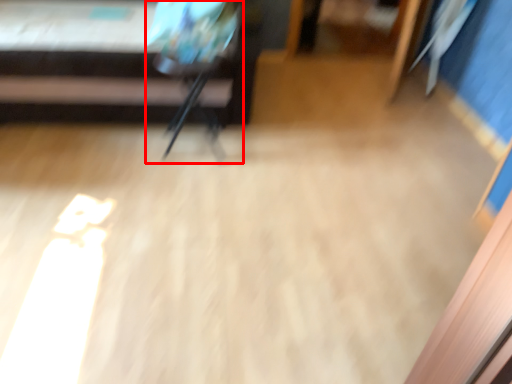
Question: Where is armchair (annotated by the red box) located in relation to furniture in the image?

Choices:
 (A) right
 (B) left

Answer: (A)